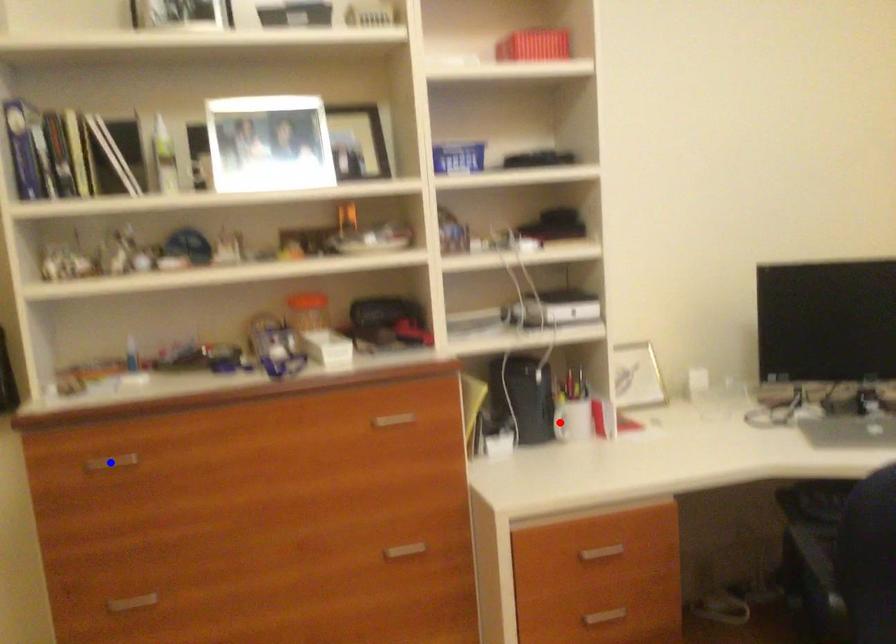
Question: Two points are marked on the image. Which point is closer to the camera?

Choices:
 (A) Blue point is closer.
 (B) Red point is closer.

Answer: (A)